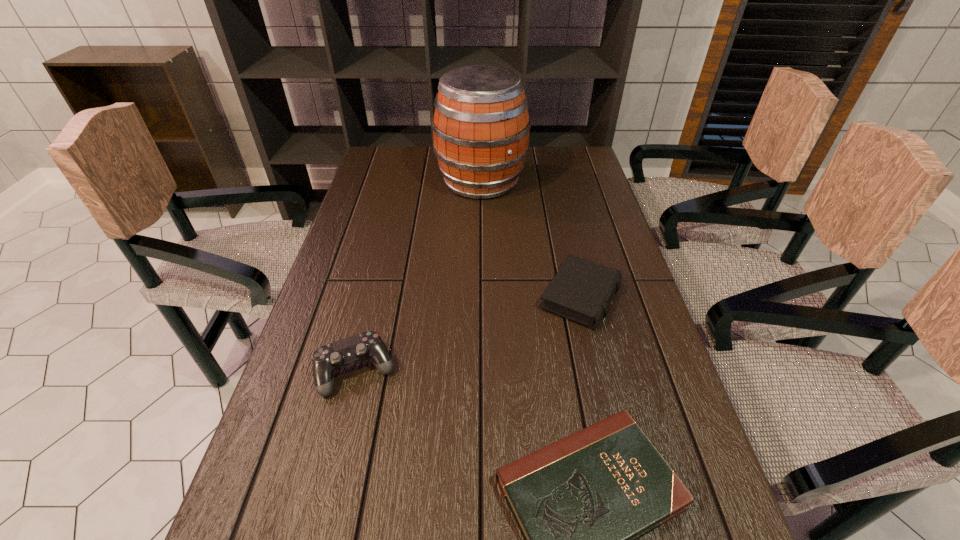
Identify which object is the second nearest to the control. Please provide its 2D coordinates. Your answer should be formatted as a tuple, i.e. [(x, y)], where the tuple contains the x and y coordinates of a point satisfying the conditions above.

[(582, 290)]